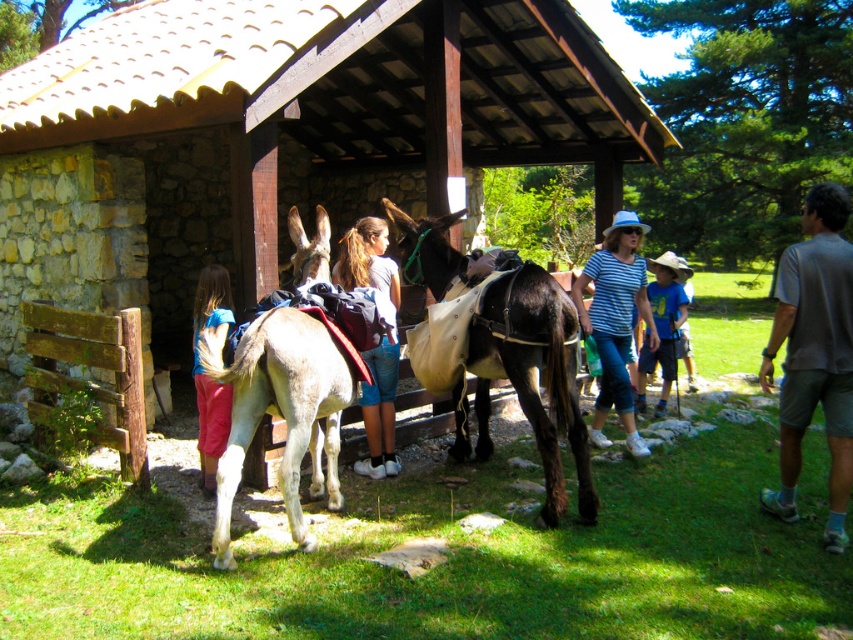
Question: Is dark brown leather mule at center further to camera compared to striped cotton shirt at center?

Choices:
 (A) yes
 (B) no

Answer: (B)

Question: From the image, what is the correct spatial relationship of dark brown leather mule at center in relation to gray fabric shirt at right?

Choices:
 (A) above
 (B) below

Answer: (B)

Question: Which object is farther from the camera taking this photo?

Choices:
 (A) striped cotton shirt at center
 (B) white matte mule at center
 (C) blue fabric pants at left

Answer: (A)

Question: Estimate the real-world distances between objects in this image. Which object is closer to the dark brown leather mule at center?

Choices:
 (A) blue fabric pants at left
 (B) denim shorts at center

Answer: (B)

Question: Does gray fabric shirt at right lie behind striped cotton shirt at center?

Choices:
 (A) no
 (B) yes

Answer: (A)

Question: Which of the following is the farthest from the observer?

Choices:
 (A) blue striped shirt at center
 (B) striped cotton shirt at center

Answer: (A)